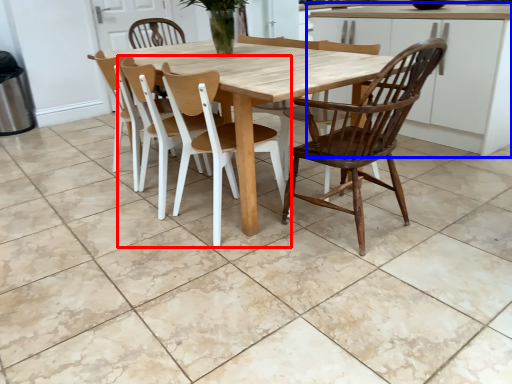
Question: Which point is closer to the camera, chair (highlighted by a red box) or cabinetry (highlighted by a blue box)?

Choices:
 (A) chair
 (B) cabinetry

Answer: (B)